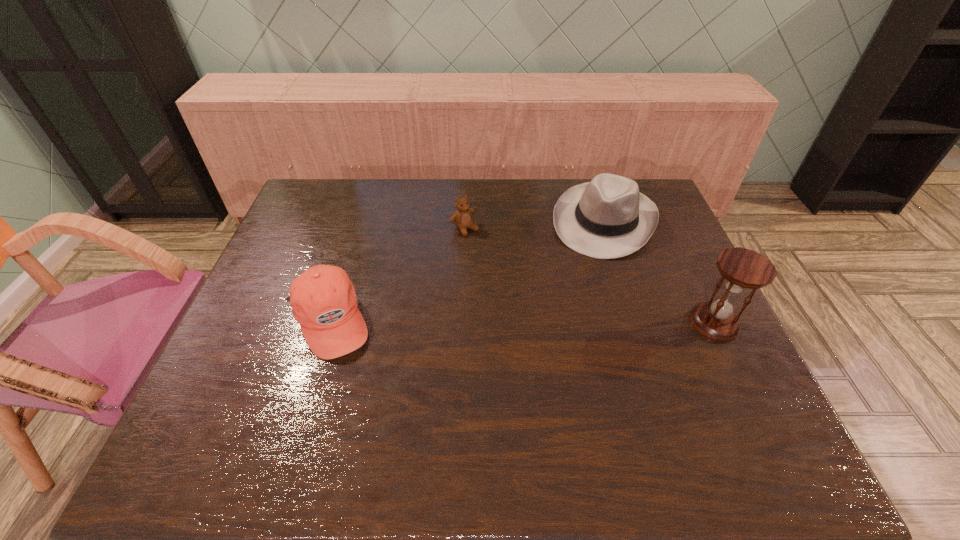
Find the location of `free spot located on the front-facing side of the fedora`. free spot located on the front-facing side of the fedora is located at coordinates (575, 298).

Where is `vacant area located on the front-facing side of the fedora`? Image resolution: width=960 pixels, height=540 pixels. vacant area located on the front-facing side of the fedora is located at coordinates (563, 330).

At what (x,y) coordinates should I click in order to perform the action: click on blank area located 0.130m on the front-facing side of the fedora. Please return your answer as a coordinate pair (x, y). Looking at the image, I should click on (580, 286).

What are the coordinates of `teddy bear that is positioned at the far edge` in the screenshot? It's located at (462, 218).

Identify the location of fedora that is at the far edge. (607, 218).

Where is `object located in the left edge section of the desktop`? object located in the left edge section of the desktop is located at coordinates coord(323,299).

Image resolution: width=960 pixels, height=540 pixels. I want to click on hourglass present at the right edge, so click(742, 269).

Locate an element on the screen. fedora at the right edge is located at coordinates [x=607, y=218].

This screenshot has height=540, width=960. Identify the location of object at the far right corner. (607, 218).

Image resolution: width=960 pixels, height=540 pixels. In the image, there is a desktop. In order to click on free region at the far edge in this screenshot , I will do `click(373, 197)`.